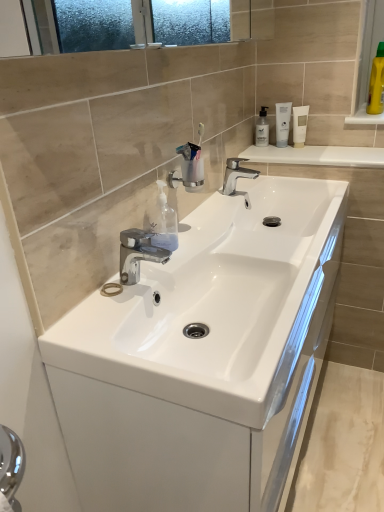
Question: Is transparent plastic soap dispenser at center with white matte tube at upper right, which is the 3th mouthwash in right-to-left order?

Choices:
 (A) yes
 (B) no

Answer: (B)

Question: Does transparent plastic soap dispenser at center lie behind white matte tube at upper right, which is the 3th mouthwash in right-to-left order?

Choices:
 (A) yes
 (B) no

Answer: (B)

Question: Is transparent plastic soap dispenser at center shorter than white matte tube at upper right, which is the 3th mouthwash in right-to-left order?

Choices:
 (A) yes
 (B) no

Answer: (A)

Question: Is transparent plastic soap dispenser at center at the right side of white matte tube at upper right, positioned as the 1th mouthwash in left-to-right order?

Choices:
 (A) yes
 (B) no

Answer: (B)

Question: From a real-world perspective, is transparent plastic soap dispenser at center on white matte tube at upper right, which is the 3th mouthwash in right-to-left order?

Choices:
 (A) no
 (B) yes

Answer: (A)

Question: Relative to white glossy countertop at upper center, is white matte tube at upper right, the second mouthwash from the right, in front or behind?

Choices:
 (A) behind
 (B) front

Answer: (A)

Question: Is white matte tube at upper right, which appears as the second mouthwash when viewed from the left, situated inside white glossy countertop at upper center or outside?

Choices:
 (A) inside
 (B) outside

Answer: (B)

Question: Based on their sizes in the image, would you say white matte tube at upper right, which appears as the second mouthwash when viewed from the left, is bigger or smaller than white glossy countertop at upper center?

Choices:
 (A) big
 (B) small

Answer: (B)

Question: Is point (297, 117) positioned closer to the camera than point (377, 163)?

Choices:
 (A) farther
 (B) closer

Answer: (A)

Question: Would you say white matte tube at upper right, which is the 3th mouthwash in right-to-left order, is inside or outside transparent plastic soap dispenser at center?

Choices:
 (A) outside
 (B) inside

Answer: (A)

Question: Considering the positions of point (279, 103) and point (155, 212), is point (279, 103) closer or farther from the camera than point (155, 212)?

Choices:
 (A) farther
 (B) closer

Answer: (A)

Question: From the image's perspective, is white matte tube at upper right, which is the 3th mouthwash in right-to-left order, above or below transparent plastic soap dispenser at center?

Choices:
 (A) below
 (B) above

Answer: (B)

Question: Based on their sizes in the image, would you say white matte tube at upper right, positioned as the 1th mouthwash in left-to-right order, is bigger or smaller than transparent plastic soap dispenser at center?

Choices:
 (A) big
 (B) small

Answer: (B)

Question: Does point (165, 307) appear closer or farther from the camera than point (306, 125)?

Choices:
 (A) closer
 (B) farther

Answer: (A)

Question: Is white glossy sink at center inside or outside of white matte tube at upper right, the second mouthwash from the right?

Choices:
 (A) outside
 (B) inside

Answer: (A)